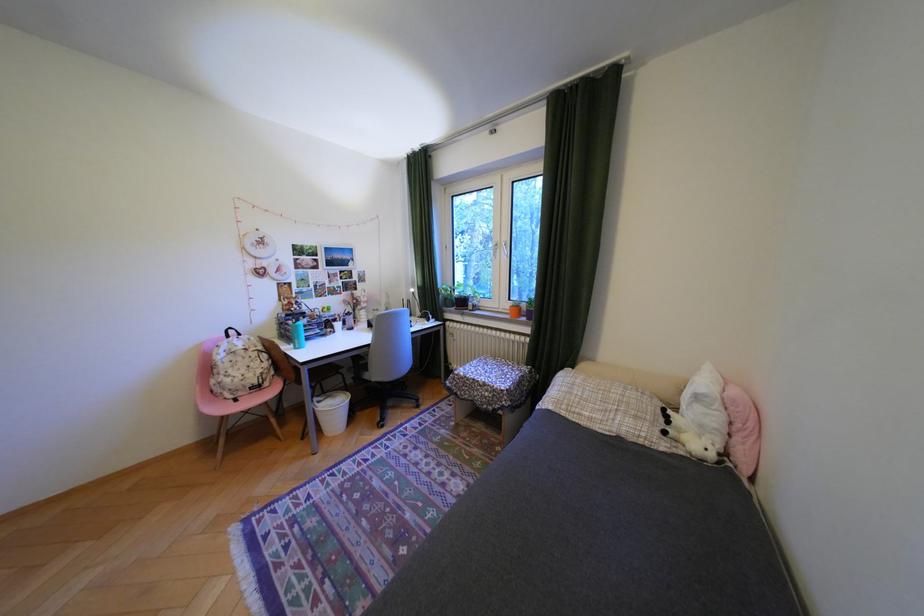
Find where to lift the blue water bottle. Please return your answer as a coordinate pair (x, y).

(297, 334)